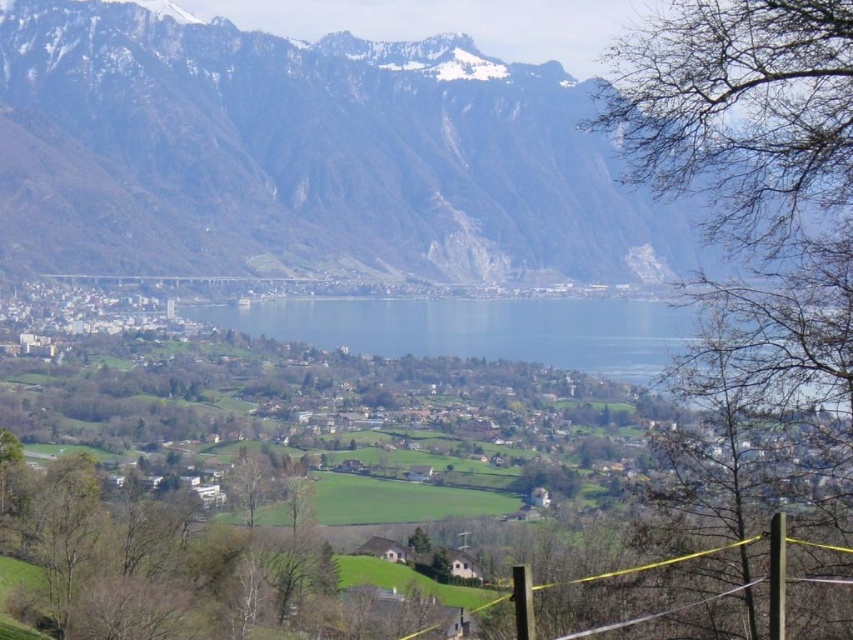
Is rocky gray mountain at upper center below clear blue water at center?

No, rocky gray mountain at upper center is not below clear blue water at center.

Is point (692, 259) positioned after point (466, 332)?

Yes, it is behind point (466, 332).

Is point (20, 216) behind point (392, 333)?

Yes, it is behind point (392, 333).

Locate an element on the screen. This screenshot has width=853, height=640. rocky gray mountain at upper center is located at coordinates (306, 156).

Is rocky gray mountain at upper center bigger than yellow string at lower right?

Yes.

This screenshot has height=640, width=853. I want to click on rocky gray mountain at upper center, so click(306, 156).

Does point (343, 333) lie in front of point (720, 547)?

No, it is not.

Find the location of `clear blue water at center`. clear blue water at center is located at coordinates (527, 333).

Identify the location of clear blue water at center. This screenshot has width=853, height=640. (527, 333).